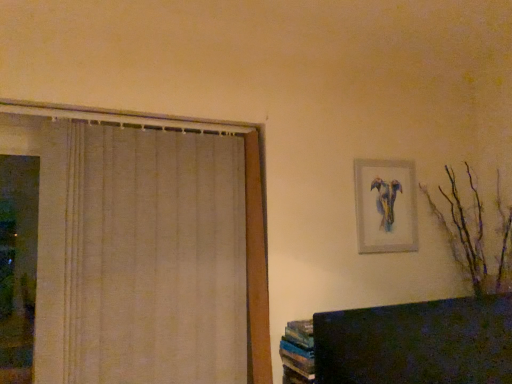
Question: Is matte silver picture frame at upper right taller than brown matte branches at right?

Choices:
 (A) yes
 (B) no

Answer: (B)

Question: From the image's perspective, is matte silver picture frame at upper right located beneath brown matte branches at right?

Choices:
 (A) no
 (B) yes

Answer: (A)

Question: From a real-world perspective, is matte silver picture frame at upper right physically above brown matte branches at right?

Choices:
 (A) no
 (B) yes

Answer: (B)

Question: Is matte silver picture frame at upper right thinner than brown matte branches at right?

Choices:
 (A) yes
 (B) no

Answer: (A)

Question: Can we say matte silver picture frame at upper right lies outside brown matte branches at right?

Choices:
 (A) no
 (B) yes

Answer: (B)

Question: From the image's perspective, would you say matte silver picture frame at upper right is positioned over brown matte branches at right?

Choices:
 (A) yes
 (B) no

Answer: (A)

Question: Can you confirm if brown matte branches at right is taller than matte silver picture frame at upper right?

Choices:
 (A) no
 (B) yes

Answer: (B)

Question: Is the depth of brown matte branches at right greater than that of matte silver picture frame at upper right?

Choices:
 (A) no
 (B) yes

Answer: (A)

Question: Is brown matte branches at right completely or partially outside of matte silver picture frame at upper right?

Choices:
 (A) no
 (B) yes

Answer: (B)

Question: Is brown matte branches at right wider than matte silver picture frame at upper right?

Choices:
 (A) yes
 (B) no

Answer: (A)

Question: Is brown matte branches at right at the right side of matte silver picture frame at upper right?

Choices:
 (A) no
 (B) yes

Answer: (B)

Question: From a real-world perspective, is brown matte branches at right located higher than matte silver picture frame at upper right?

Choices:
 (A) yes
 (B) no

Answer: (B)

Question: Considering the relative sizes of beige fabric curtain at left and matte silver picture frame at upper right in the image provided, is beige fabric curtain at left taller than matte silver picture frame at upper right?

Choices:
 (A) no
 (B) yes

Answer: (B)